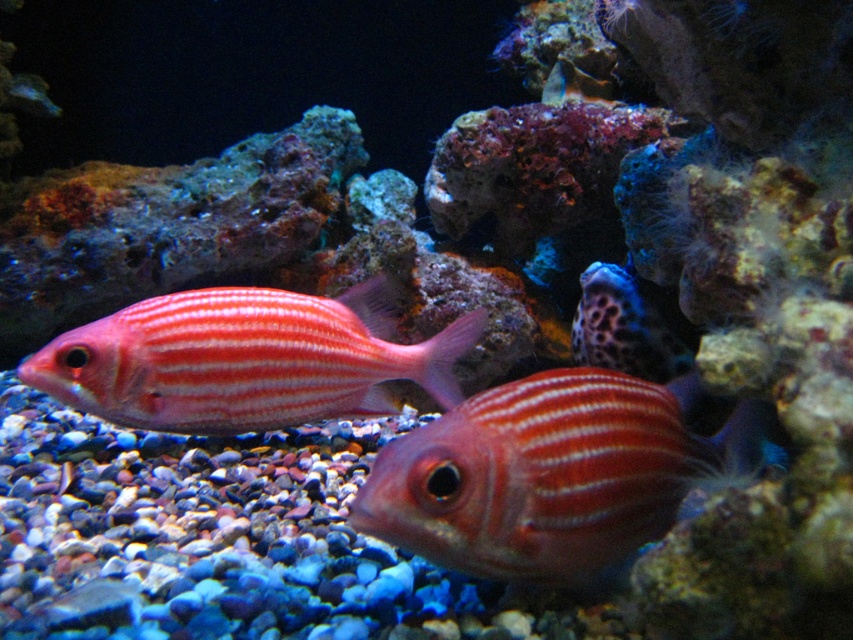
Question: Is shiny red fish at center further to the viewer compared to leopard print rock at center?

Choices:
 (A) yes
 (B) no

Answer: (B)

Question: Which is nearer to the shiny pink fish at center?

Choices:
 (A) shiny red fish at center
 (B) leopard print rock at center

Answer: (A)

Question: Which point is farther to the camera?

Choices:
 (A) (329, 376)
 (B) (488, 572)
 (C) (601, 294)

Answer: (C)

Question: Among these points, which one is farthest from the camera?

Choices:
 (A) (129, 380)
 (B) (412, 467)
 (C) (662, 342)

Answer: (C)

Question: Is shiny pink fish at center to the left of leopard print rock at center from the viewer's perspective?

Choices:
 (A) yes
 (B) no

Answer: (A)

Question: Does shiny red fish at center appear on the right side of leopard print rock at center?

Choices:
 (A) no
 (B) yes

Answer: (A)